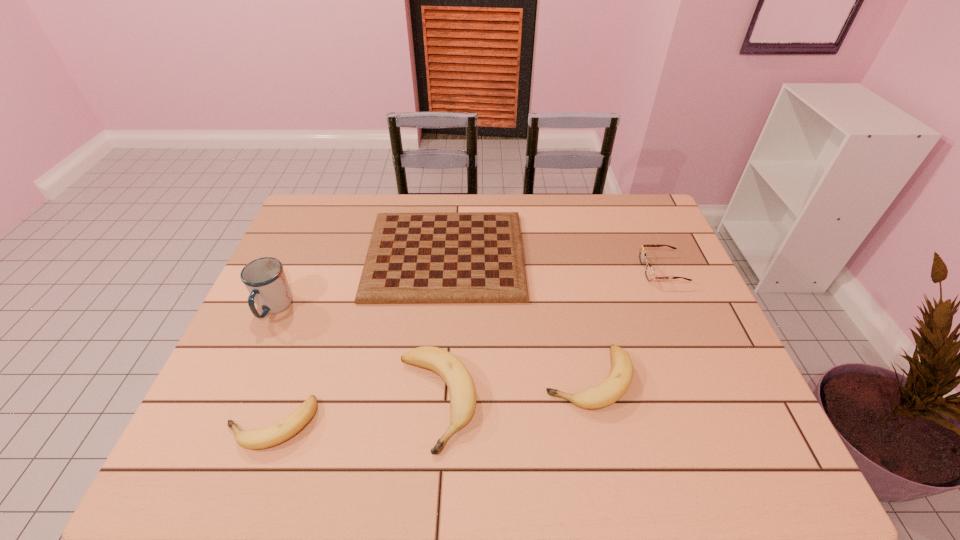
Please point a spot on the right to add another banana. Please provide its 2D coordinates. Your answer should be formatted as a tuple, i.e. [(x, y)], where the tuple contains the x and y coordinates of a point satisfying the conditions above.

[(729, 359)]